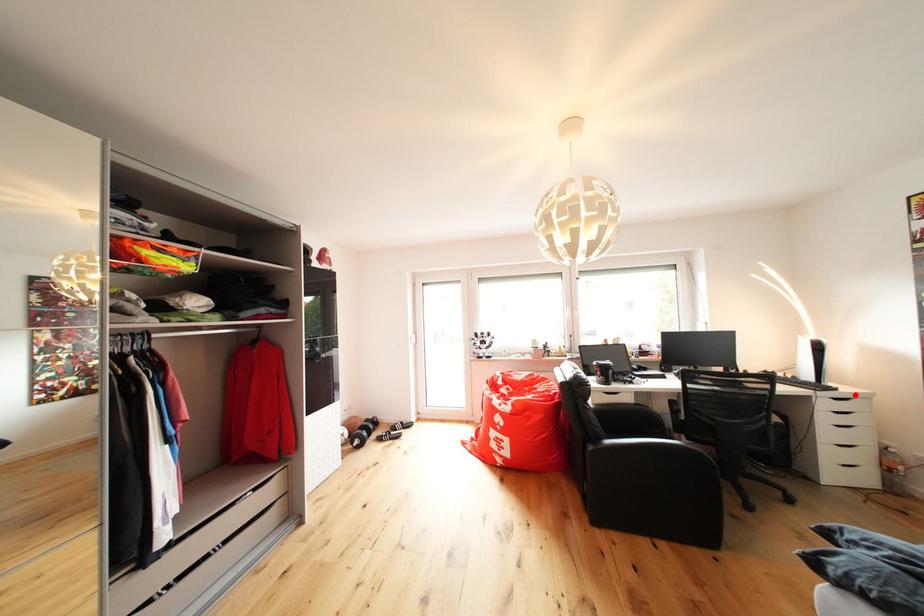
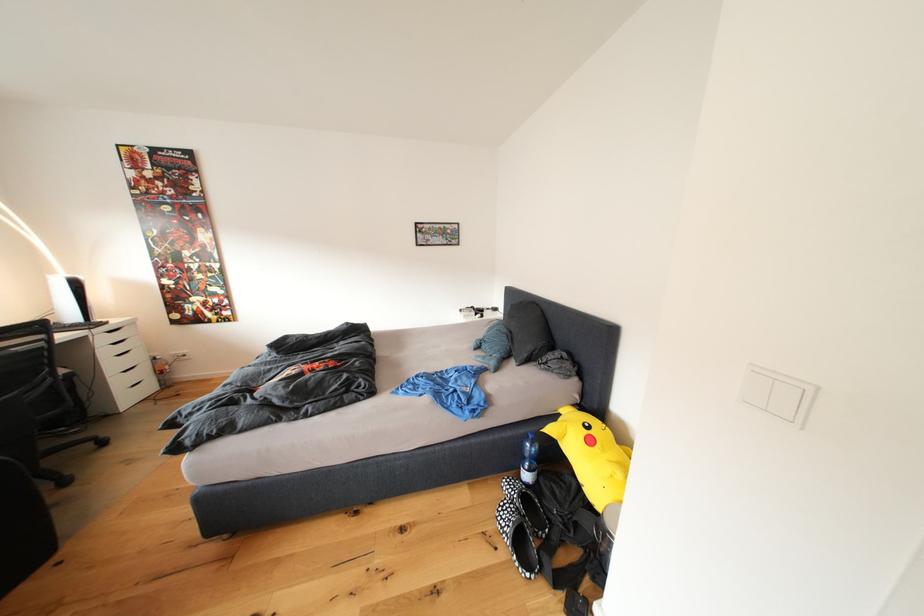
In the second image, find the point that corresponds to the highlighted location in the first image.

(125, 326)